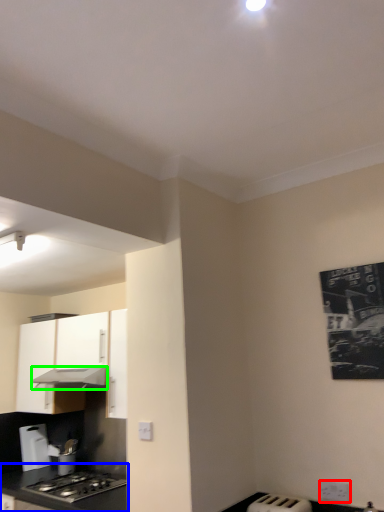
Question: Which object is the closest to the electric outlet (highlighted by a red box)? Choose among these: countertop (highlighted by a blue box) or exhaust hood (highlighted by a green box).

Choices:
 (A) countertop
 (B) exhaust hood

Answer: (A)